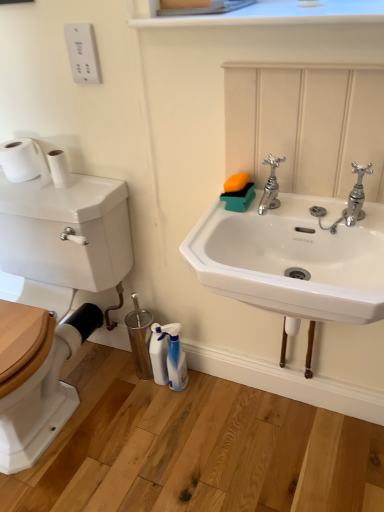
Question: Does white smooth window sill at upper center have a smaller size compared to chrome metallic faucet at upper right, which appears as the second tap when viewed from the left?

Choices:
 (A) yes
 (B) no

Answer: (B)

Question: Is white smooth window sill at upper center located outside chrome metallic faucet at upper right, which ranks as the first tap in right-to-left order?

Choices:
 (A) no
 (B) yes

Answer: (B)

Question: Does white smooth window sill at upper center have a lesser height compared to chrome metallic faucet at upper right, which appears as the second tap when viewed from the left?

Choices:
 (A) no
 (B) yes

Answer: (B)

Question: Is white smooth window sill at upper center turned away from chrome metallic faucet at upper right, which appears as the second tap when viewed from the left?

Choices:
 (A) no
 (B) yes

Answer: (A)

Question: Is white smooth window sill at upper center to the right of chrome metallic faucet at upper right, which appears as the second tap when viewed from the left, from the viewer's perspective?

Choices:
 (A) no
 (B) yes

Answer: (A)

Question: Is chrome metallic faucet at upper right, which ranks as the first tap in right-to-left order, inside or outside of white smooth window sill at upper center?

Choices:
 (A) outside
 (B) inside

Answer: (A)

Question: Considering the positions of chrome metallic faucet at upper right, which appears as the second tap when viewed from the left, and white smooth window sill at upper center in the image, is chrome metallic faucet at upper right, which appears as the second tap when viewed from the left, taller or shorter than white smooth window sill at upper center?

Choices:
 (A) short
 (B) tall

Answer: (B)

Question: From a real-world perspective, relative to white smooth window sill at upper center, is chrome metallic faucet at upper right, which appears as the second tap when viewed from the left, vertically above or below?

Choices:
 (A) above
 (B) below

Answer: (B)

Question: Relative to white smooth window sill at upper center, is chrome metallic faucet at upper right, which ranks as the first tap in right-to-left order, in front or behind?

Choices:
 (A) behind
 (B) front

Answer: (A)

Question: Is point (271, 204) positioned closer to the camera than point (56, 151)?

Choices:
 (A) farther
 (B) closer

Answer: (B)

Question: From a real-world perspective, is chrome metallic faucet at upper center, the second tap viewed from the right, physically located above or below white matte toilet paper at left, positioned as the second toilet paper in left-to-right order?

Choices:
 (A) above
 (B) below

Answer: (A)

Question: In the image, is chrome metallic faucet at upper center, the second tap viewed from the right, on the left side or the right side of white matte toilet paper at left, positioned as the second toilet paper in left-to-right order?

Choices:
 (A) left
 (B) right

Answer: (B)

Question: Is chrome metallic faucet at upper center, the second tap viewed from the right, situated inside white matte toilet paper at left, positioned as the second toilet paper in left-to-right order, or outside?

Choices:
 (A) inside
 (B) outside

Answer: (B)

Question: Does point (56, 166) appear closer or farther from the camera than point (14, 155)?

Choices:
 (A) closer
 (B) farther

Answer: (A)

Question: From a real-world perspective, is white matte toilet paper at left, positioned as the second toilet paper in left-to-right order, above or below white matte toilet paper at left, which is counted as the 2th toilet paper, starting from the right?

Choices:
 (A) above
 (B) below

Answer: (B)